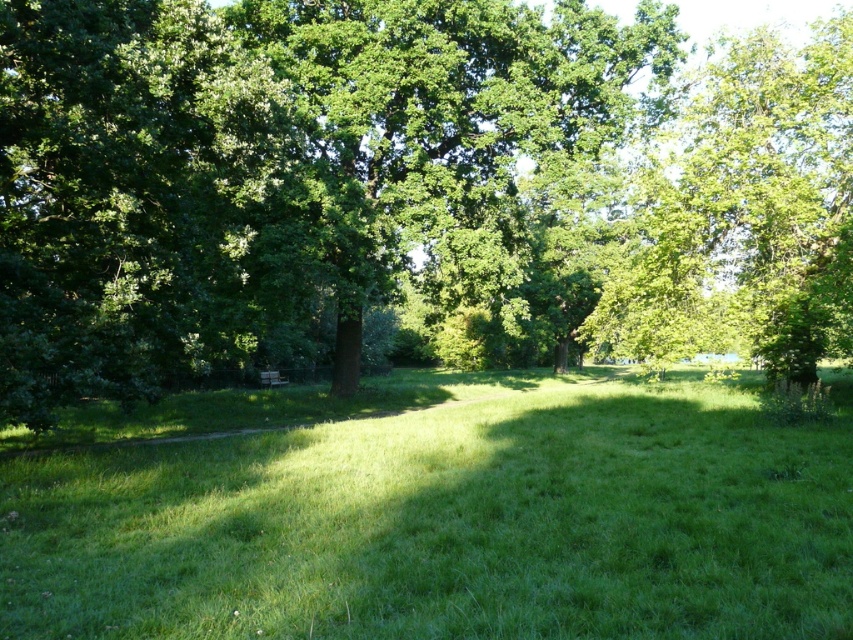
Question: Is green leafy tree at center to the right of green grassy field at center from the viewer's perspective?

Choices:
 (A) yes
 (B) no

Answer: (A)

Question: Does green leafy tree at center have a larger size compared to green grassy field at center?

Choices:
 (A) yes
 (B) no

Answer: (A)

Question: Can you confirm if green leafy tree at center is thinner than green grassy field at center?

Choices:
 (A) no
 (B) yes

Answer: (A)